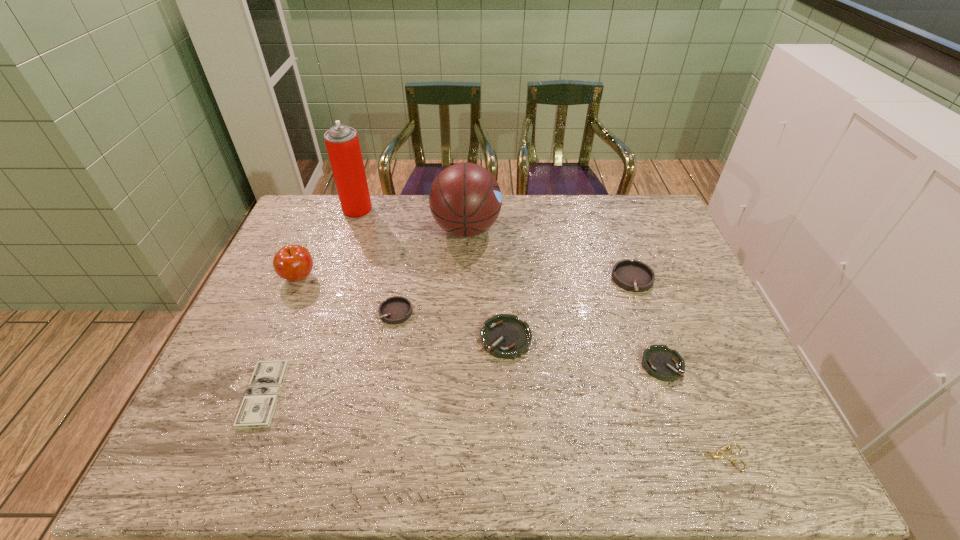
Locate an element on the screen. The height and width of the screenshot is (540, 960). free space between the nearest object and the dollar is located at coordinates (491, 426).

You are a GUI agent. You are given a task and a screenshot of the screen. Output one action in this format:
    pyautogui.click(x=<x>, y=<y>)
    Task: Click on the free area in between the seventh shortest object and the sixth shortest object
    The height and width of the screenshot is (540, 960).
    Given the screenshot: What is the action you would take?
    pyautogui.click(x=466, y=279)

Find the location of a particular element. vacant area between the right gray ashtray and the second tallest object is located at coordinates (550, 255).

Find the location of a particular element. The image size is (960, 540). vacant area that lies between the leftmost ashtray and the seventh shortest object is located at coordinates (348, 294).

Where is `vacant space that is in between the red aerosol can and the third ashtray from right to left`? The image size is (960, 540). vacant space that is in between the red aerosol can and the third ashtray from right to left is located at coordinates (x=432, y=274).

The width and height of the screenshot is (960, 540). Find the location of `blank region between the aerosol can and the dollar`. blank region between the aerosol can and the dollar is located at coordinates (311, 302).

The width and height of the screenshot is (960, 540). I want to click on the third closest object to the tallest object, so click(x=394, y=310).

Locate an element on the screen. The width and height of the screenshot is (960, 540). the fourth closest object relative to the second ashtray from left to right is located at coordinates (465, 199).

The height and width of the screenshot is (540, 960). What are the coordinates of `the closest ashtray to the red aerosol can` in the screenshot? It's located at (394, 310).

Where is `the fourth closest ashtray to the nearest object`? The height and width of the screenshot is (540, 960). the fourth closest ashtray to the nearest object is located at coordinates (394, 310).